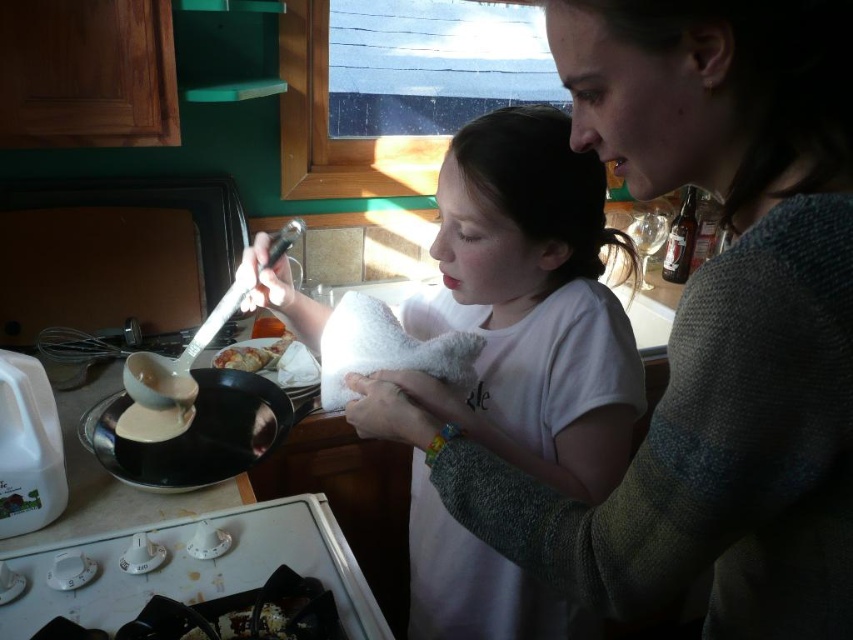
Question: Is knitted gray sweater at upper right bigger than white soft towel at center?

Choices:
 (A) yes
 (B) no

Answer: (B)

Question: Which of the following is the farthest from the observer?

Choices:
 (A) (787, 381)
 (B) (196, 410)

Answer: (B)

Question: Observing the image, what is the correct spatial positioning of knitted gray sweater at upper right in reference to slightly browned crispy chicken at center?

Choices:
 (A) above
 (B) below

Answer: (A)

Question: Which object is positioned closest to the white soft towel at center?

Choices:
 (A) slightly browned crispy chicken at center
 (B) knitted gray sweater at upper right
 (C) black matte frying pan at lower left
 (D) white glossy stove at lower left

Answer: (B)

Question: Which object is closer to the camera taking this photo?

Choices:
 (A) white soft towel at center
 (B) knitted gray sweater at upper right
 (C) white glossy stove at lower left

Answer: (B)

Question: Does knitted gray sweater at upper right have a smaller size compared to white glossy stove at lower left?

Choices:
 (A) yes
 (B) no

Answer: (B)